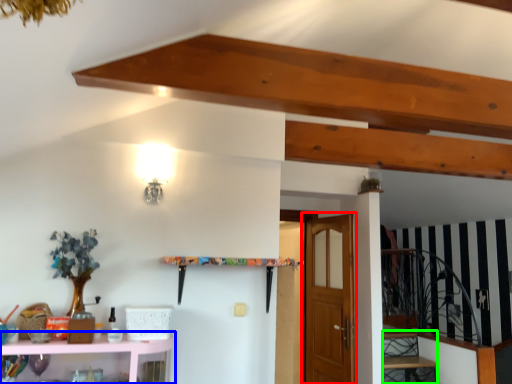
Question: Which object is the farthest from door (highlighted by a red box)? Choose among these: shelf (highlighted by a blue box) or stairwell (highlighted by a green box).

Choices:
 (A) shelf
 (B) stairwell

Answer: (A)